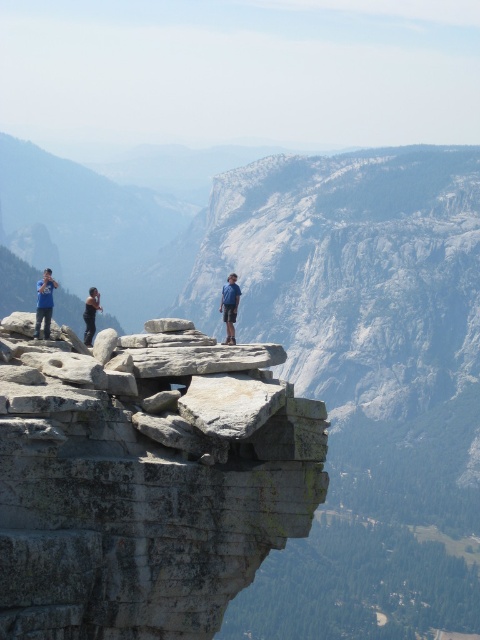
Can you confirm if gray/weathered rock at center is positioned to the left of matte blue shirt at left?

Incorrect, gray/weathered rock at center is not on the left side of matte blue shirt at left.

Who is more forward, (25, 636) or (47, 321)?

Point (25, 636)

Does point (48, 592) come closer to viewer compared to point (51, 289)?

Yes.

The height and width of the screenshot is (640, 480). Identify the location of gray/weathered rock at center. (145, 480).

Which is more to the left, gray/weathered rock at center or blue denim shorts at center?

Positioned to the left is blue denim shorts at center.

Does gray/weathered rock at center have a lesser height compared to blue denim shorts at center?

No.

This screenshot has width=480, height=640. I want to click on gray/weathered rock at center, so [x=145, y=480].

Who is shorter, blue denim shorts at center or black fabric shirt at left?

With less height is black fabric shirt at left.

Between blue denim shorts at center and black fabric shirt at left, which one appears on the left side from the viewer's perspective?

black fabric shirt at left is more to the left.

Between point (226, 291) and point (93, 330), which one is positioned in front?

Point (93, 330) is more forward.

You are a GUI agent. You are given a task and a screenshot of the screen. Output one action in this format:
    pyautogui.click(x=<x>, y=<y>)
    Task: Click on the blue denim shorts at center
    
    Given the screenshot: What is the action you would take?
    pyautogui.click(x=229, y=307)